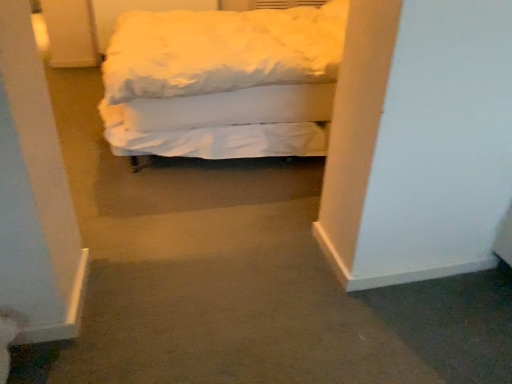
What do you see at coordinates (223, 82) in the screenshot?
I see `white fabric bed at center` at bounding box center [223, 82].

Locate an element on the screen. The height and width of the screenshot is (384, 512). white fabric bed at center is located at coordinates (223, 82).

You are a GUI agent. You are given a task and a screenshot of the screen. Output one action in this format:
    pyautogui.click(x=<x>, y=<y>)
    Task: Click on the white fabric bed at center
    This screenshot has height=384, width=512.
    Given the screenshot: What is the action you would take?
    pyautogui.click(x=223, y=82)